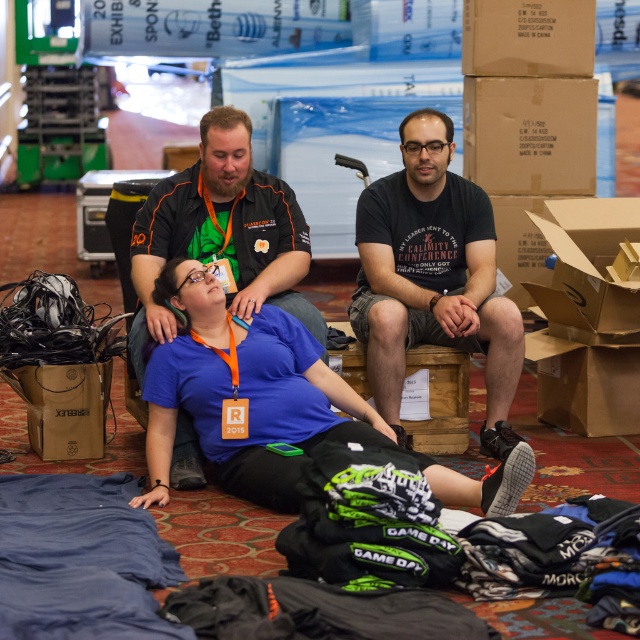
Who is more forward, [492,234] or [564,32]?

Point [492,234] is more forward.

Who is shorter, black cotton t-shirt at center or brown cardboard box at upper right?

With less height is brown cardboard box at upper right.

You are a GUI agent. You are given a task and a screenshot of the screen. Output one action in this format:
    pyautogui.click(x=<x>, y=<y>)
    Task: Click on the black cotton t-shirt at center
    
    Given the screenshot: What is the action you would take?
    point(433,276)

Is brown cardboard box at upper center below cardboard box at right?

Actually, brown cardboard box at upper center is above cardboard box at right.

Which is more to the right, brown cardboard box at upper center or cardboard box at right?

From the viewer's perspective, cardboard box at right appears more on the right side.

I want to click on brown cardboard box at upper center, so click(x=529, y=134).

Between point (464, 13) and point (435, 452), which one is positioned behind?

Positioned behind is point (464, 13).

Is point (529, 51) less distant than point (417, 352)?

That is False.

Is point (467, 20) more distant than point (433, 426)?

Yes.

Where is `brown cardboard box at upper right`? brown cardboard box at upper right is located at coordinates (x=529, y=36).